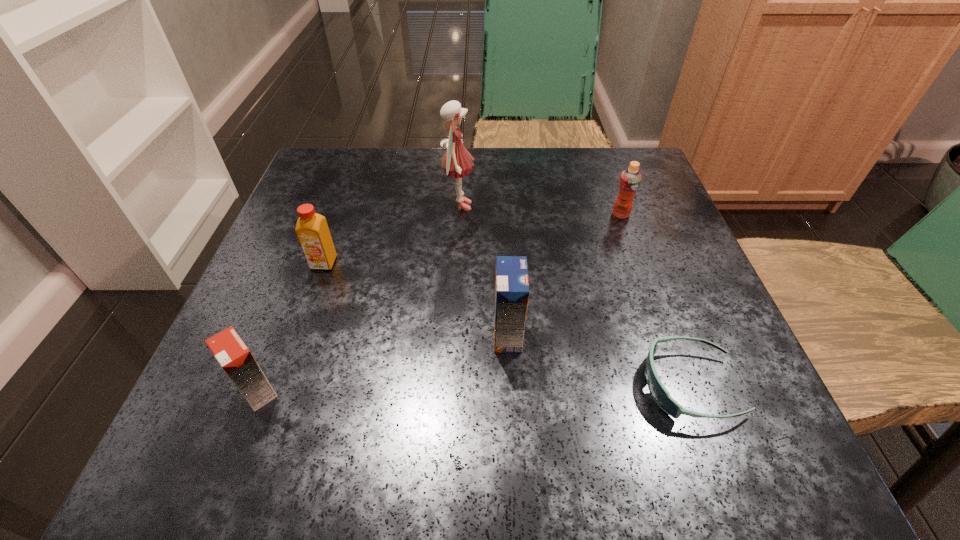
Locate an element on the screen. orange juice that is at the right edge is located at coordinates (630, 179).

Find the location of a particular element. This screenshot has width=960, height=540. goggles that is at the right edge is located at coordinates (659, 393).

The width and height of the screenshot is (960, 540). I want to click on object that is positioned at the near left corner, so click(x=230, y=351).

Where is `object that is at the far right corner`? The width and height of the screenshot is (960, 540). object that is at the far right corner is located at coordinates (630, 179).

The height and width of the screenshot is (540, 960). In order to click on object that is at the near right corner in this screenshot , I will do `click(659, 393)`.

Find the location of a particular element. Image resolution: width=960 pixels, height=540 pixels. vacant space at the far edge is located at coordinates (435, 185).

Where is `vacant space at the near edge of the desktop`? The image size is (960, 540). vacant space at the near edge of the desktop is located at coordinates (630, 411).

The image size is (960, 540). Find the location of `vacant space at the left edge`. vacant space at the left edge is located at coordinates (281, 230).

You are a GUI agent. You are given a task and a screenshot of the screen. Output one action in this format:
    pyautogui.click(x=<x>, y=<y>)
    Task: Click on the vacant space at the right edge
    The image size is (960, 540).
    Given the screenshot: What is the action you would take?
    pyautogui.click(x=642, y=401)

Identify the location of vacant point at the far left corner. The image size is (960, 540). (361, 161).